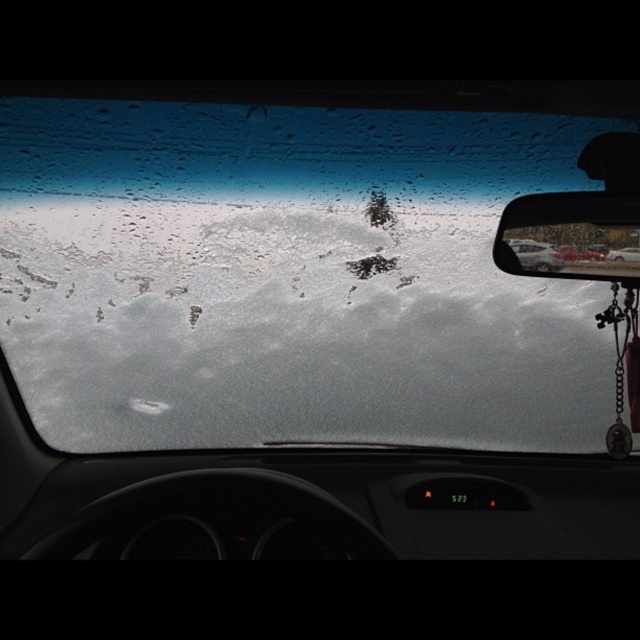
Question: Which point is farther from the camera taking this photo?

Choices:
 (A) (472, 134)
 (B) (612, 256)

Answer: (A)

Question: Is frosted glass windshield at center in front of shiny plastic rearview mirror at upper right?

Choices:
 (A) yes
 (B) no

Answer: (B)

Question: Observing the image, what is the correct spatial positioning of frosted glass windshield at center in reference to shiny plastic rearview mirror at upper right?

Choices:
 (A) below
 (B) above

Answer: (A)

Question: Which of the following is the closest to the observer?

Choices:
 (A) shiny plastic rearview mirror at upper right
 (B) frosted glass windshield at center

Answer: (A)

Question: Among these points, which one is farthest from the camera?

Choices:
 (A) (621, 257)
 (B) (598, 358)

Answer: (B)

Question: Does frosted glass windshield at center have a smaller size compared to shiny plastic rearview mirror at upper right?

Choices:
 (A) no
 (B) yes

Answer: (A)